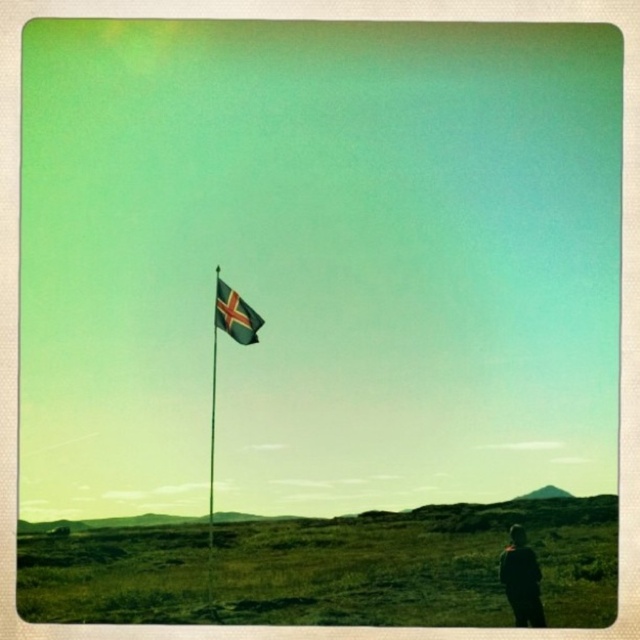
Does point (531, 612) come closer to viewer compared to point (250, 337)?

Yes.

Does dark fabric jacket at lower right have a larger size compared to silky fabric flag at center?

Yes, dark fabric jacket at lower right is bigger than silky fabric flag at center.

This screenshot has width=640, height=640. In order to click on dark fabric jacket at lower right in this screenshot , I will do `click(522, 579)`.

Who is higher up, silky fabric flag at center or white/black striped flag pole at center?

silky fabric flag at center is higher up.

Can you confirm if silky fabric flag at center is shorter than white/black striped flag pole at center?

Yes, silky fabric flag at center is shorter than white/black striped flag pole at center.

Who is more forward, (228,298) or (209,506)?

Point (209,506)

Find the location of a particular element. This screenshot has width=640, height=640. silky fabric flag at center is located at coordinates (236, 316).

Does dark fabric jacket at lower right have a greater height compared to white/black striped flag pole at center?

No.

Between dark fabric jacket at lower right and white/black striped flag pole at center, which one is positioned lower?

dark fabric jacket at lower right

Where is `dark fabric jacket at lower right`? dark fabric jacket at lower right is located at coordinates (522, 579).